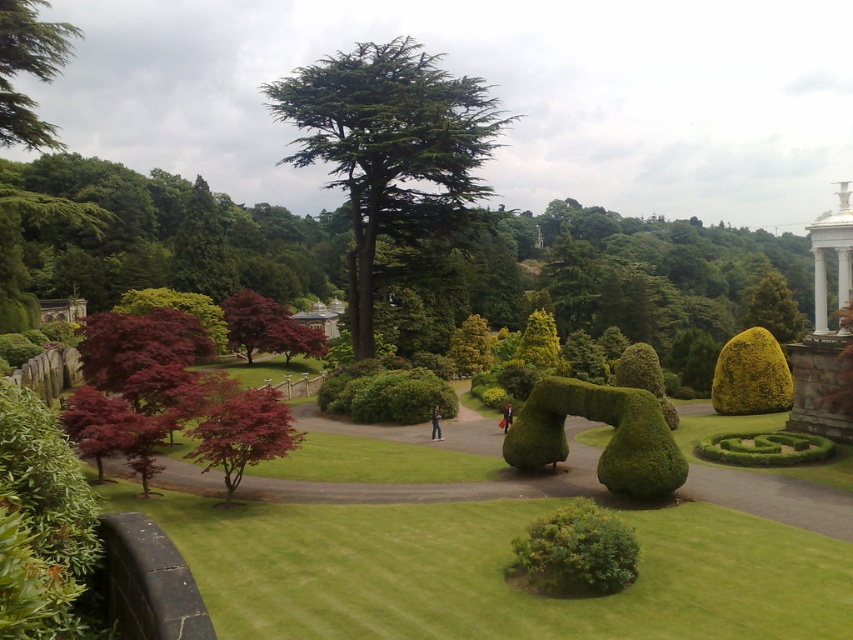
You are planning to install a new lighting fixture in the garden. The white marble gazebo at right is your focal point. Based on its position, where should you place the light to best illuminate the gazebo without obstructing the view from the curved pathway?

The white marble gazebo at right is located at point (824, 330), so placing the light fixture behind or to the side of the gazebo along the curved pathway would ensure proper illumination while maintaining an unobstructed view.